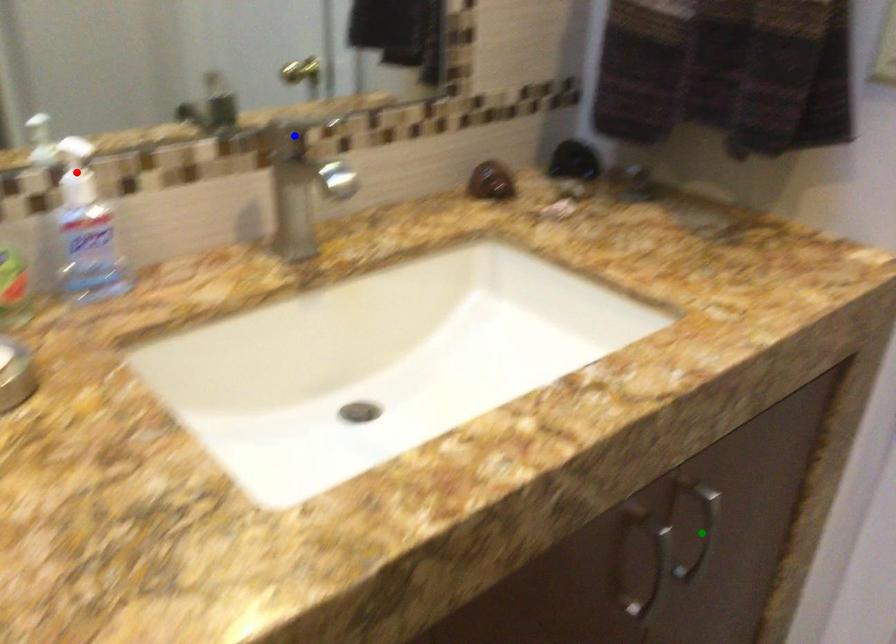
Order these from nearest to farthest:
1. red point
2. green point
3. blue point

red point
blue point
green point